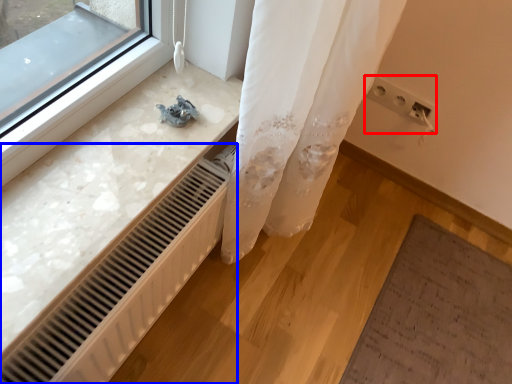
Question: Which object appears farthest to the camera in this image, electric outlet (highlighted by a red box) or radiator (highlighted by a blue box)?

Choices:
 (A) electric outlet
 (B) radiator

Answer: (A)